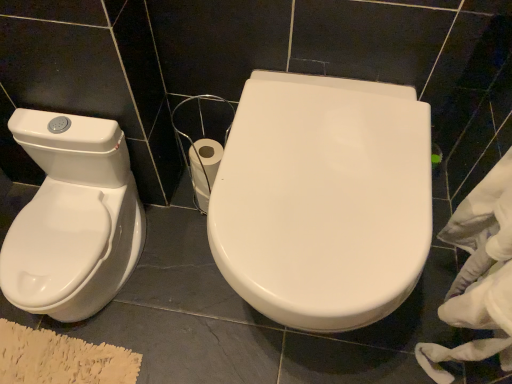
Question: Does white glossy toilet seat at center have a lesser width compared to white glossy bidet at left?

Choices:
 (A) no
 (B) yes

Answer: (A)

Question: Is white glossy toilet seat at center smaller than white glossy bidet at left?

Choices:
 (A) no
 (B) yes

Answer: (A)

Question: From the image's perspective, is white glossy toilet seat at center under white glossy bidet at left?

Choices:
 (A) yes
 (B) no

Answer: (B)

Question: Considering the relative sizes of white glossy toilet seat at center and white glossy bidet at left in the image provided, is white glossy toilet seat at center bigger than white glossy bidet at left?

Choices:
 (A) no
 (B) yes

Answer: (B)

Question: From a real-world perspective, is white glossy toilet seat at center physically above white glossy bidet at left?

Choices:
 (A) yes
 (B) no

Answer: (A)

Question: Is the surface of white glossy toilet seat at center in direct contact with white glossy bidet at left?

Choices:
 (A) yes
 (B) no

Answer: (B)

Question: Considering the relative positions of white glossy toilet seat at center and white fabric at right in the image provided, is white glossy toilet seat at center in front of white fabric at right?

Choices:
 (A) no
 (B) yes

Answer: (A)

Question: Is white glossy toilet seat at center not within white fabric at right?

Choices:
 (A) no
 (B) yes

Answer: (B)

Question: Does white glossy toilet seat at center have a greater width compared to white fabric at right?

Choices:
 (A) no
 (B) yes

Answer: (B)

Question: Considering the relative sizes of white glossy toilet seat at center and white fabric at right in the image provided, is white glossy toilet seat at center taller than white fabric at right?

Choices:
 (A) yes
 (B) no

Answer: (B)

Question: Can you confirm if white glossy toilet seat at center is positioned to the left of white fabric at right?

Choices:
 (A) yes
 (B) no

Answer: (A)

Question: Can you confirm if white glossy toilet seat at center is thinner than white fabric at right?

Choices:
 (A) no
 (B) yes

Answer: (A)

Question: Does white fabric at right lie in front of white glossy toilet seat at center?

Choices:
 (A) no
 (B) yes

Answer: (B)